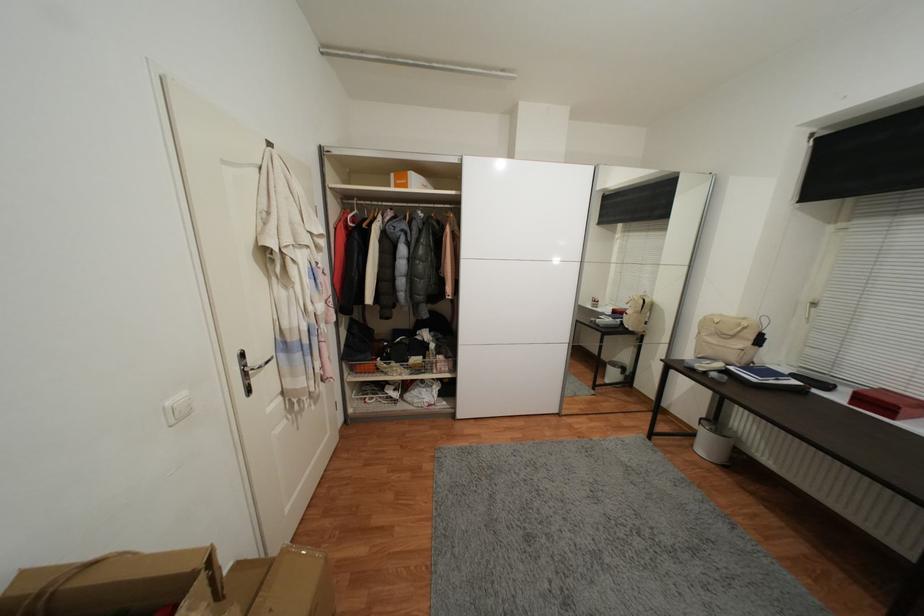
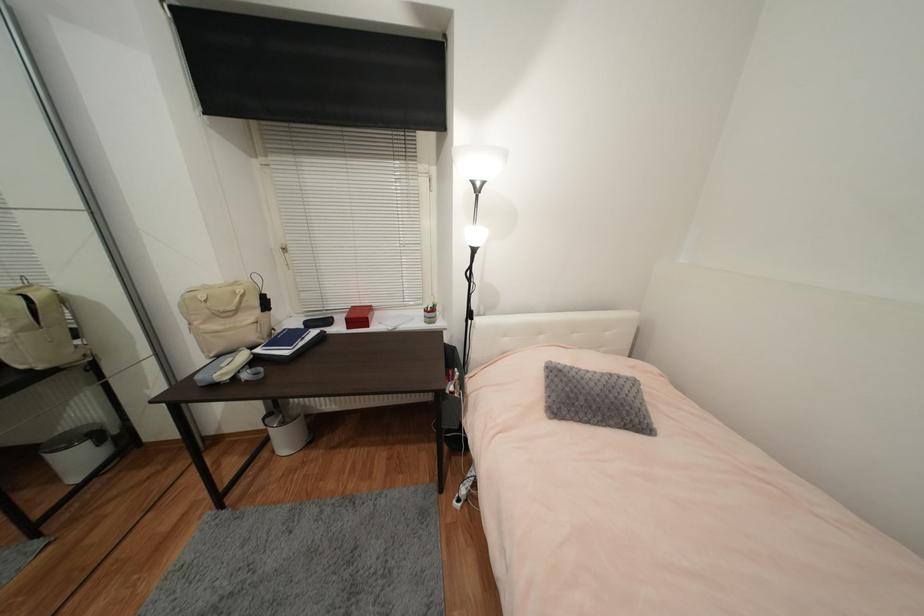
In the second image, find the point that corresponds to [889,405] in the first image.

(363, 318)